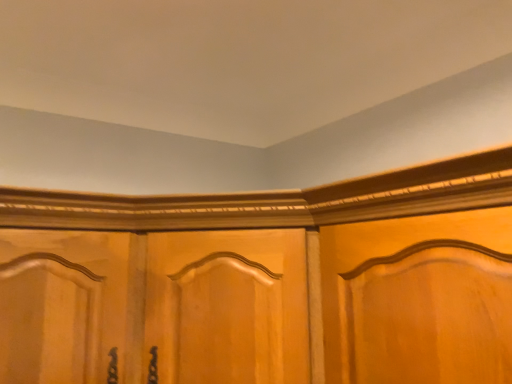
Image resolution: width=512 pixels, height=384 pixels. I want to click on glossy wood dresser at center, so click(x=276, y=201).

Describe the element at coordinates (276, 201) in the screenshot. The height and width of the screenshot is (384, 512). I see `glossy wood dresser at center` at that location.

Identify the location of glossy wood dresser at center. The image size is (512, 384). (276, 201).